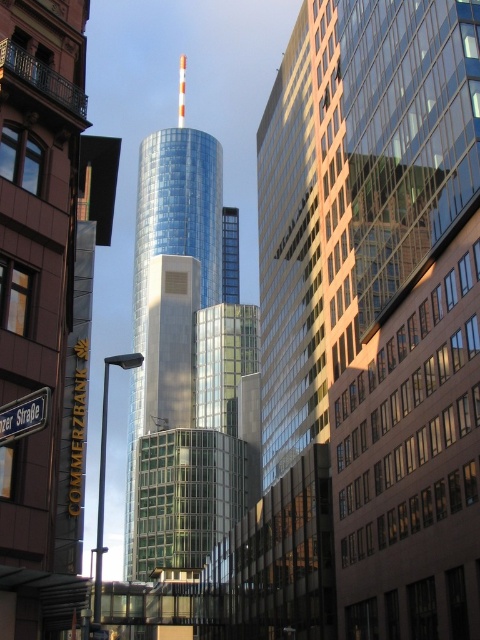
Question: Is shiny glass tower at center to the right of black metal street sign at lower left from the viewer's perspective?

Choices:
 (A) no
 (B) yes

Answer: (A)

Question: Which object is closer to the camera taking this photo?

Choices:
 (A) shiny glass tower at center
 (B) black metal street sign at lower left

Answer: (B)

Question: Can you confirm if shiny glass tower at center is smaller than black metal street sign at lower left?

Choices:
 (A) no
 (B) yes

Answer: (A)

Question: Which point appears closest to the camera in this image?

Choices:
 (A) click(6, 433)
 (B) click(154, 269)

Answer: (A)

Question: Considering the relative positions of shiny glass tower at center and black metal street sign at lower left in the image provided, where is shiny glass tower at center located with respect to black metal street sign at lower left?

Choices:
 (A) right
 (B) left

Answer: (B)